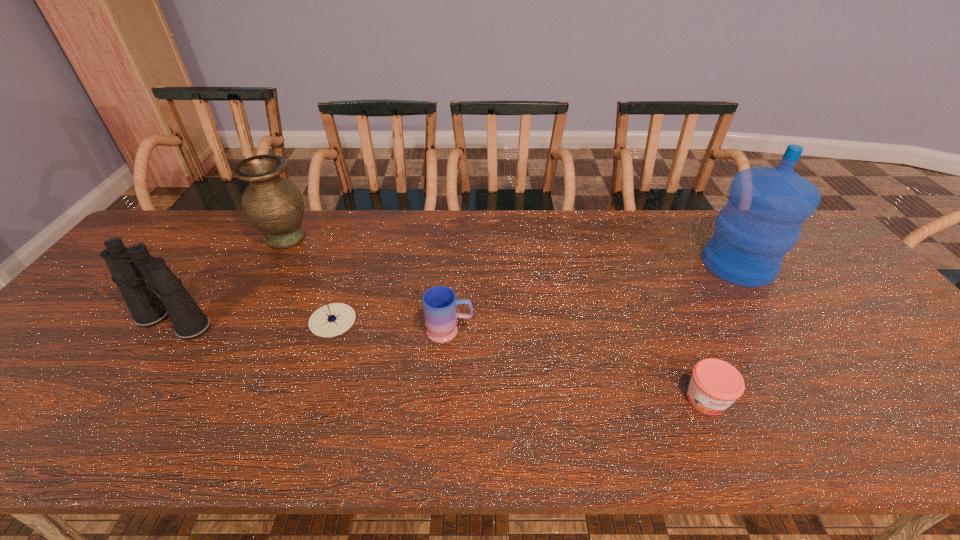
In order to click on vacant space at the right edge in this screenshot , I will do `click(903, 339)`.

The height and width of the screenshot is (540, 960). Find the location of `vacant area at the far left corner`. vacant area at the far left corner is located at coordinates (169, 221).

The image size is (960, 540). In the image, there is a desktop. Identify the location of blank space at the near right corner. (957, 454).

Locate an element on the screen. The height and width of the screenshot is (540, 960). vacant point located between the second object from right to left and the binoculars is located at coordinates (440, 361).

I want to click on free spot between the compass and the vase, so click(309, 279).

You are a GUI agent. You are given a task and a screenshot of the screen. Output one action in this format:
    pyautogui.click(x=<x>, y=<y>)
    Task: Click on the vacant space that is in between the compass and the binoculars
    Image resolution: width=960 pixels, height=540 pixels.
    Given the screenshot: What is the action you would take?
    pyautogui.click(x=253, y=322)

Where is `free space between the tallest object and the binoculars`? free space between the tallest object and the binoculars is located at coordinates (456, 294).

This screenshot has width=960, height=540. Find the location of `free spot between the tallest object and the shortest object`. free spot between the tallest object and the shortest object is located at coordinates (536, 293).

The image size is (960, 540). I want to click on vacant area that lies between the binoculars and the vase, so click(229, 280).

Identify the location of unoccupied position between the jam and the binoculars. (440, 361).